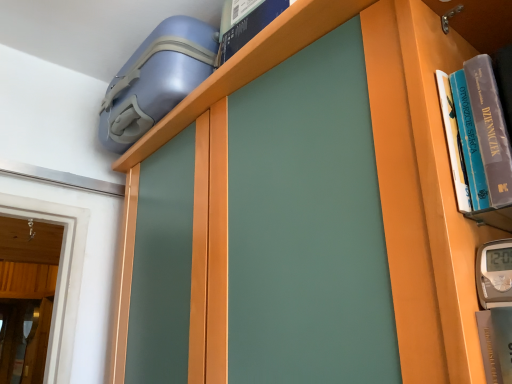
Image resolution: width=512 pixels, height=384 pixels. Describe the element at coordinates (442, 187) in the screenshot. I see `hardcover books at right` at that location.

Locate an element on the screen. The height and width of the screenshot is (384, 512). hardcover books at right is located at coordinates (442, 187).

Where is `hardcover books at right`? hardcover books at right is located at coordinates (442, 187).